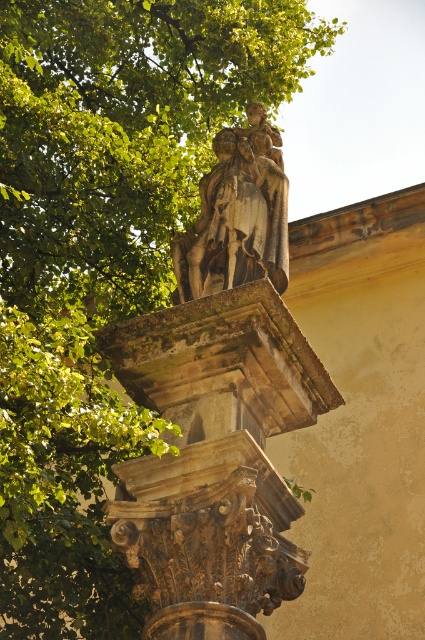
You are an architect examining a classical sculpture. You notice a point at coordinates (215,460). What object is located at that point?

The point at coordinates (215,460) is where the carved stone column at center is located.

You are an architect analyzing the classical sculpture and column. You notice two points marked on the structure. Which point is closer to the viewer, point (139, 589) or point (261, 256)?

Point (139, 589) is in front of point (261, 256), so it is closer to the viewer.

You are an architect designing a new plaza and want to place a bench between the carved stone column at center and the polished bronze statue at center. The bench is 2 meters long. Can the bench fit between them without overlapping either structure?

The distance between the carved stone column at center and the polished bronze statue at center is 11.06 meters. Since the bench is only 2 meters long, there is sufficient space to place it between them without overlapping either structure.